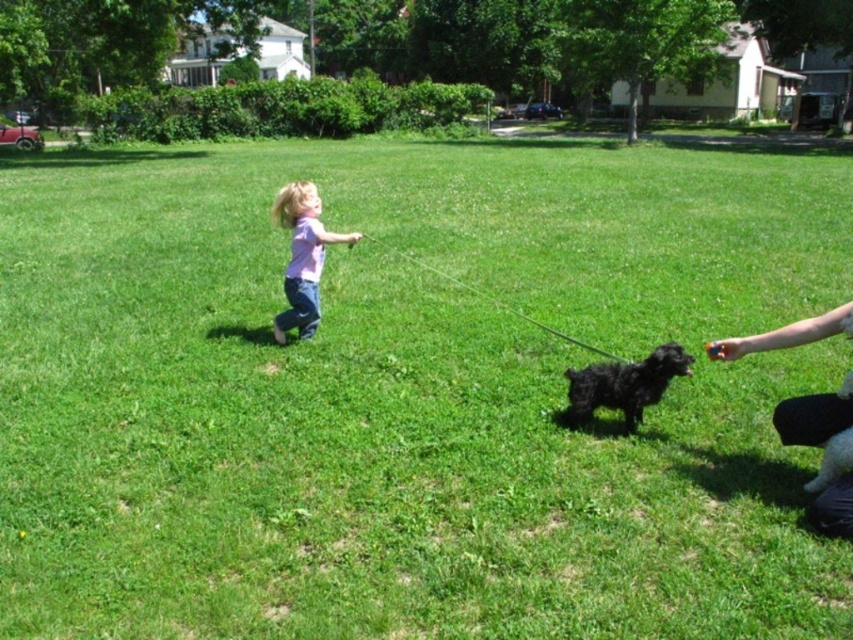
Is pink cotton shirt at center bigger than black fuzzy dog at center?

Yes.

This screenshot has width=853, height=640. Identify the location of pink cotton shirt at center. (302, 257).